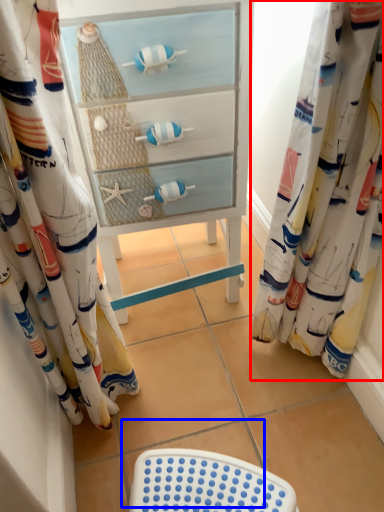
Question: Which of the following is the closest to the observer, curtain (highlighted by a red box) or tile (highlighted by a blue box)?

Choices:
 (A) curtain
 (B) tile

Answer: (A)